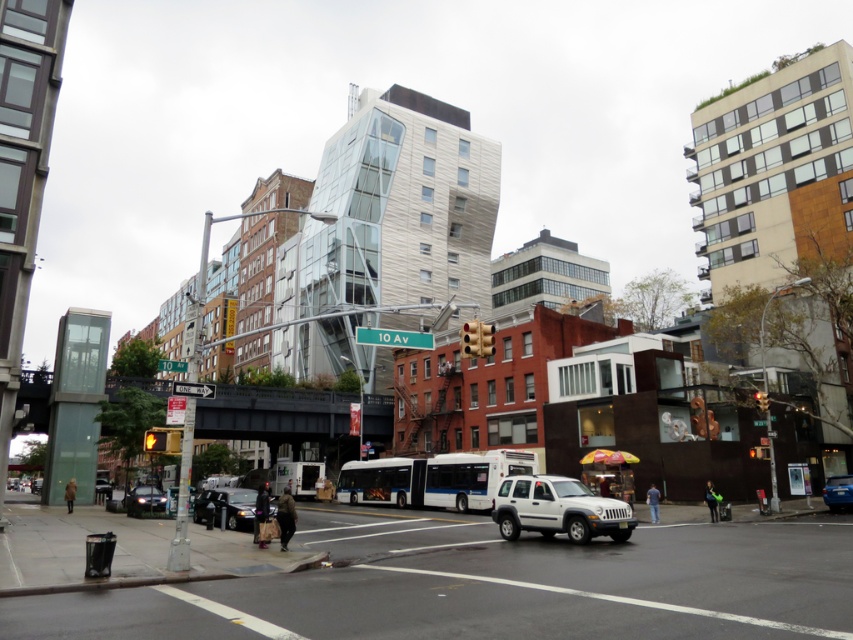
Question: Which point is closer to the camera?

Choices:
 (A) blue matte car at lower right
 (B) yellow glass traffic light at upper center

Answer: (B)

Question: Is shiny black sedan at lower left to the left of red glass traffic light at center from the viewer's perspective?

Choices:
 (A) no
 (B) yes

Answer: (B)

Question: Does shiny black sedan at lower left lie behind yellow glass traffic light at upper center?

Choices:
 (A) yes
 (B) no

Answer: (A)

Question: Which object is positioned closest to the shiny black sedan at center?

Choices:
 (A) blue matte car at lower right
 (B) shiny black sedan at lower left

Answer: (B)

Question: Which of the following is the closest to the observer?

Choices:
 (A) (466, 324)
 (B) (839, 486)
 (C) (763, 404)

Answer: (A)

Question: Is shiny black sedan at lower left to the right of red glass traffic light at center from the viewer's perspective?

Choices:
 (A) yes
 (B) no

Answer: (B)